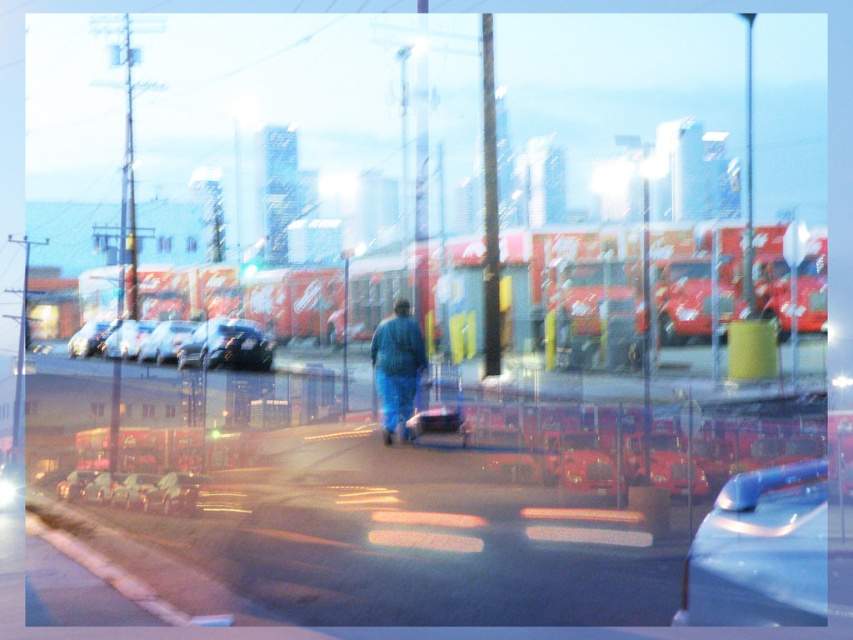
Is shiny black sedan at left to the right of blue denim pants at center from the viewer's perspective?

In fact, shiny black sedan at left is to the left of blue denim pants at center.

Which is behind, point (135, 337) or point (381, 406)?

The point (135, 337) is behind.

At what (x,y) coordinates should I click in order to perform the action: click on shiny black sedan at left. Please return your answer as a coordinate pair (x, y). The image size is (853, 640). Looking at the image, I should click on (187, 342).

Image resolution: width=853 pixels, height=640 pixels. Identify the location of shiny black sedan at left. (187, 342).

Consider the image. Between blue denim pants at center and shiny silver car at center, which one is positioned higher?

shiny silver car at center is higher up.

Does blue denim pants at center appear on the left side of shiny silver car at center?

Incorrect, blue denim pants at center is not on the left side of shiny silver car at center.

Identify the location of blue denim pants at center. (397, 369).

This screenshot has height=640, width=853. In order to click on blue denim pants at center in this screenshot , I will do `click(397, 369)`.

The height and width of the screenshot is (640, 853). What do you see at coordinates (663, 465) in the screenshot? I see `metallic red truck at center` at bounding box center [663, 465].

Is metallic red truck at center below metallic silver car at center?

Correct, metallic red truck at center is located below metallic silver car at center.

Locate an element on the screen. This screenshot has height=640, width=853. metallic red truck at center is located at coordinates (663, 465).